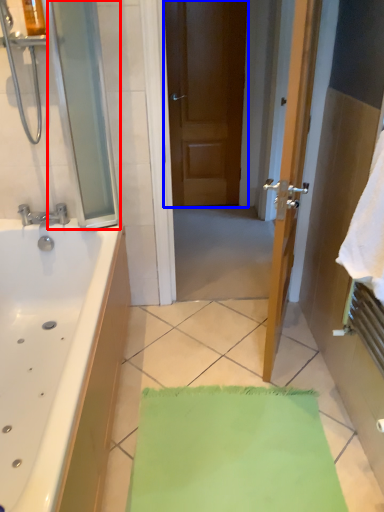
Question: Which object appears closest to the camera in this image, screen door (highlighted by a red box) or door (highlighted by a blue box)?

Choices:
 (A) screen door
 (B) door

Answer: (A)